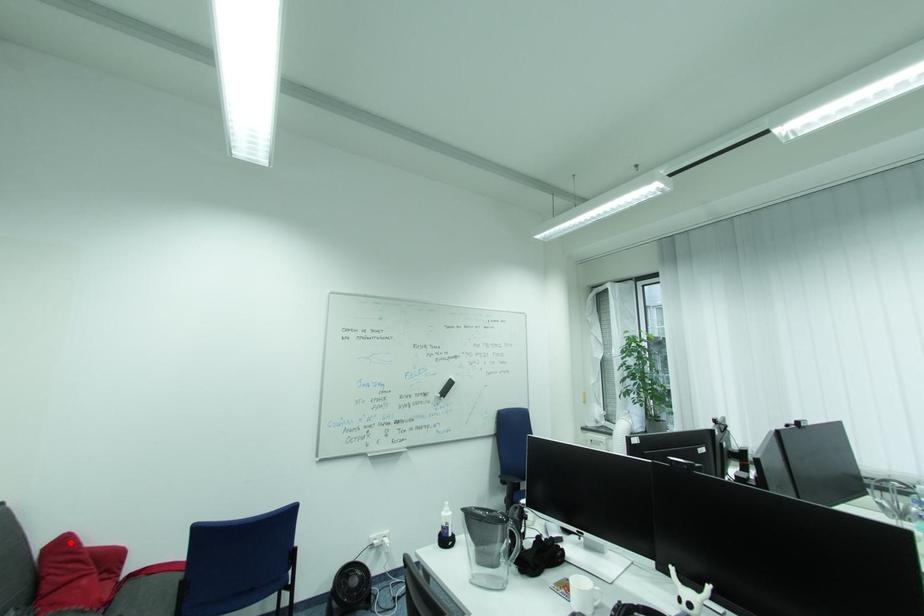
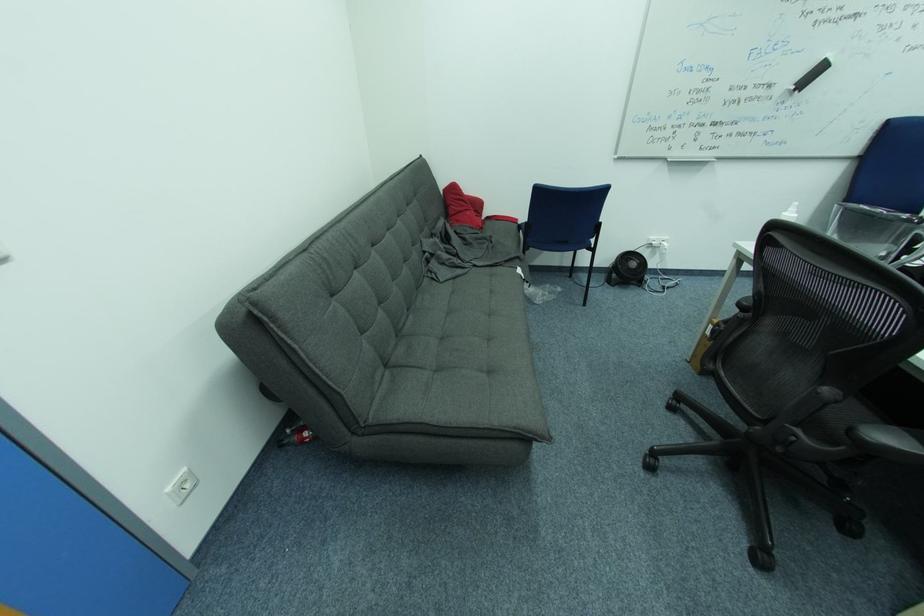
Question: A red point is marked in image1. In image2, is the corresponding 3D point closer to the camera or farther? Reply with the corresponding letter.

Choices:
 (A) The corresponding 3D point is closer.
 (B) The corresponding 3D point is farther.

Answer: (A)